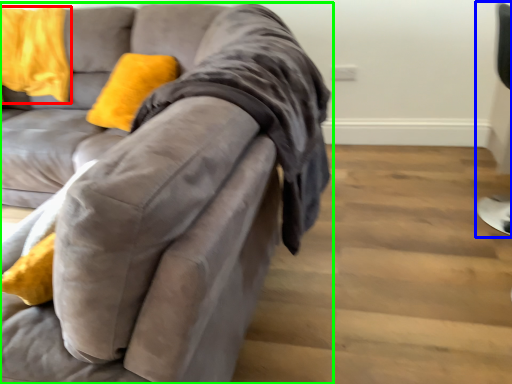
Question: Which is farther away from pillow (highlighted by a red box)? computer chair (highlighted by a blue box) or studio couch (highlighted by a green box)?

Choices:
 (A) computer chair
 (B) studio couch

Answer: (A)